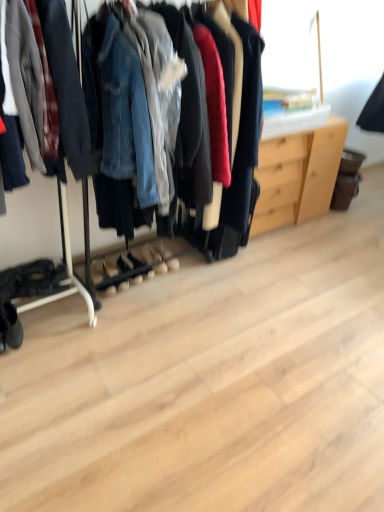
Question: Is black suede boot at lower left inside or outside of light wood dresser at center?

Choices:
 (A) inside
 (B) outside

Answer: (B)

Question: Is black suede boot at lower left to the left or to the right of light wood dresser at center in the image?

Choices:
 (A) right
 (B) left

Answer: (B)

Question: Considering their positions, is black suede boot at lower left located in front of or behind light wood dresser at center?

Choices:
 (A) behind
 (B) front

Answer: (B)

Question: Considering the positions of point pyautogui.click(x=339, y=155) and point pyautogui.click(x=18, y=335), is point pyautogui.click(x=339, y=155) closer or farther from the camera than point pyautogui.click(x=18, y=335)?

Choices:
 (A) closer
 (B) farther

Answer: (B)

Question: From the image's perspective, relative to black suede boot at lower left, is light wood dresser at center above or below?

Choices:
 (A) above
 (B) below

Answer: (A)

Question: From a real-world perspective, is light wood dresser at center physically located above or below black suede boot at lower left?

Choices:
 (A) above
 (B) below

Answer: (A)

Question: Looking at the image, does light wood dresser at center seem bigger or smaller compared to black suede boot at lower left?

Choices:
 (A) big
 (B) small

Answer: (A)